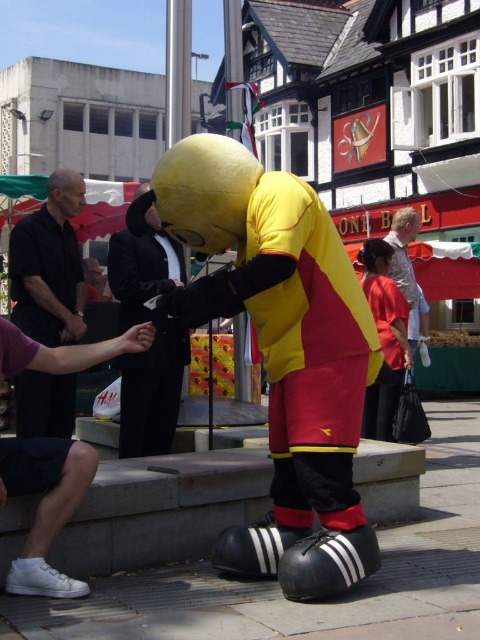
You are a photographer at the event and need to capture both the yellow plush mascot at center and the black matte shirt at left in a single frame. Based on their sizes, which object should you focus on first to ensure both are in the frame?

The yellow plush mascot at center is taller than the black matte shirt at left, so you should focus on the yellow plush mascot at center first to ensure both are in the frame.

You are a photographer at the event and need to capture both the black suit at center and the matte yellow costume at center in a single frame. Which costume should you position closer to the camera to ensure both are visible clearly?

Since the black suit at center is larger in size than the matte yellow costume at center, you should position the matte yellow costume at center closer to the camera to ensure both are visible clearly.